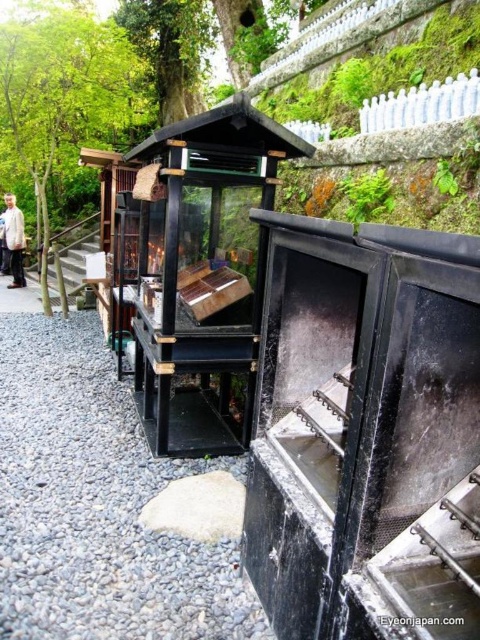
Question: Which object is positioned closest to the gray gravel path at left?

Choices:
 (A) gray gravel at lower left
 (B) white cotton shirt at left

Answer: (B)

Question: Can you confirm if white cotton shirt at left is wider than gray gravel path at left?

Choices:
 (A) no
 (B) yes

Answer: (A)

Question: Which of the following is the closest to the observer?

Choices:
 (A) white cotton shirt at left
 (B) gray gravel at lower left

Answer: (B)

Question: Can you confirm if gray gravel at lower left is positioned above gray gravel path at left?

Choices:
 (A) no
 (B) yes

Answer: (A)

Question: Does gray gravel at lower left come in front of white cotton shirt at left?

Choices:
 (A) no
 (B) yes

Answer: (B)

Question: Which point is closer to the camera?

Choices:
 (A) white cotton shirt at left
 (B) gray gravel at lower left
 (C) gray gravel path at left

Answer: (B)